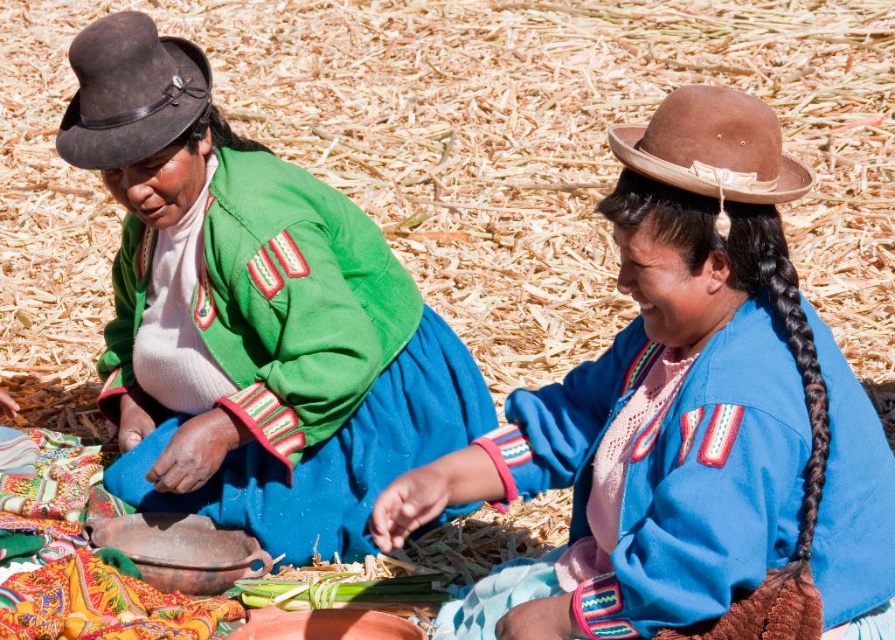
You are a photographer trying to capture a closeup of the green woven fabric at left and the dark brown suede hat at upper left in the scene. Given that your camera can focus on objects within a 20 inch range, will both items be in focus?

The green woven fabric at left is 21.91 inches away from the dark brown suede hat at upper left. Since the distance between them exceeds the camera focus range of 20 inches, the photographer cannot have both items in focus simultaneously.

You are an observer standing in front of the image. You notice two hats in the scene. Which hat is closer to you, the dark brown suede hat at upper left or the brown suede cowboy hat at upper right?

The dark brown suede hat at upper left is closer to you because the brown suede cowboy hat at upper right is positioned behind it.